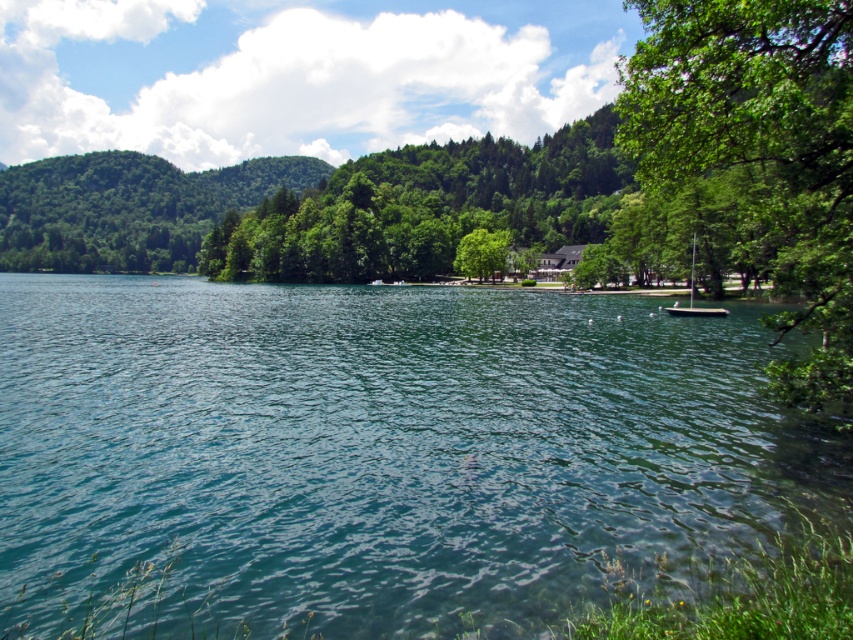
You are planning to take a photo of the white plastic boat at right and the green leafy tree at center. Which object should you zoom in on to capture more details without moving the camera, considering their sizes?

The green leafy tree at center is wider than the white plastic boat at right, so you should zoom in on the green leafy tree at center to capture more details without moving the camera since it has a larger size.

From the picture: You are standing at the lakeside and see the green leafy tree at right and the green leafy tree at center. Which tree is located more to the right side of the scene?

The green leafy tree at right is positioned on the right side of the green leafy tree at center, so it is located more to the right side of the scene.

You are standing on the lakeside and want to reach the white plastic boat at right. However, you notice the green leafy tree at center is blocking your path. Can you walk around the tree to get to the boat?

The white plastic boat at right is behind the green leafy tree at center, so you can walk around the tree to reach the boat.